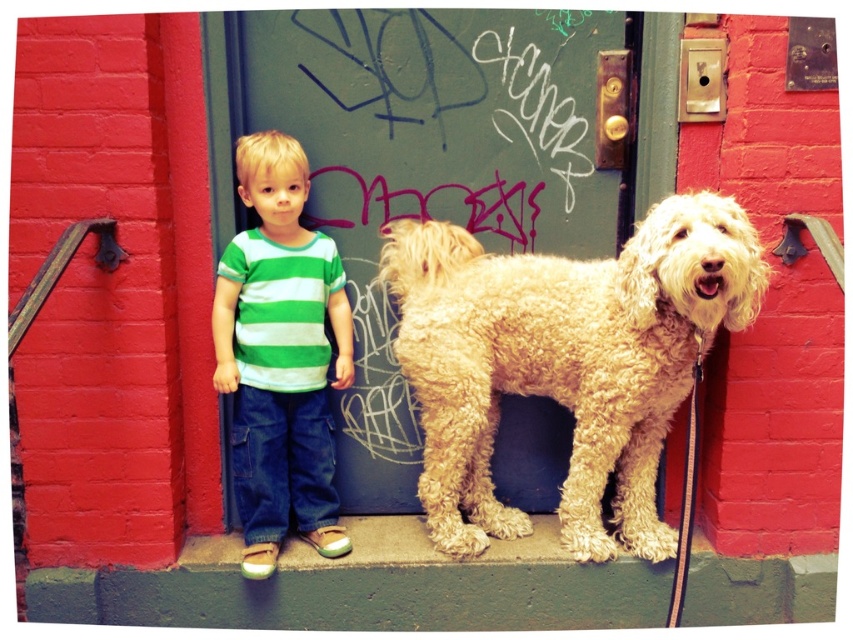
Question: Which point appears closest to the camera in this image?

Choices:
 (A) (231, 320)
 (B) (511, 227)

Answer: (A)

Question: Does golden curly fur dog at center have a greater width compared to green striped shirt at center?

Choices:
 (A) no
 (B) yes

Answer: (B)

Question: Is golden curly fur dog at center further to camera compared to green striped shirt at center?

Choices:
 (A) no
 (B) yes

Answer: (A)

Question: Which point is farther from the camera taking this photo?

Choices:
 (A) [x=454, y=554]
 (B) [x=265, y=513]
 (C) [x=416, y=170]

Answer: (C)

Question: Is golden curly fur dog at center to the left of green striped shirt at center from the viewer's perspective?

Choices:
 (A) yes
 (B) no

Answer: (B)

Question: Among these points, which one is farthest from the camera?

Choices:
 (A) (675, 308)
 (B) (285, 458)
 (C) (273, 42)

Answer: (B)